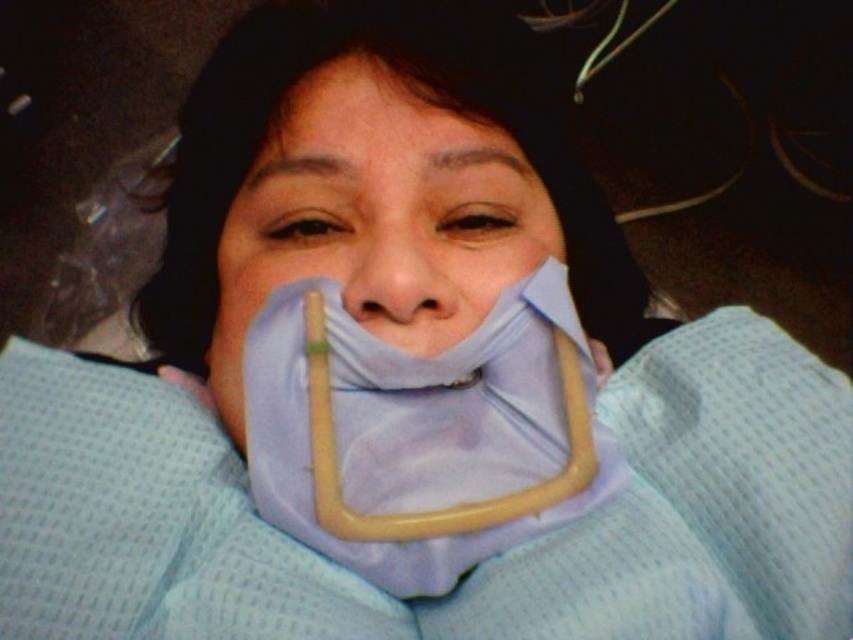
Question: Does light blue fabric at center have a larger size compared to blue fabric mask at center?

Choices:
 (A) no
 (B) yes

Answer: (A)

Question: Estimate the real-world distances between objects in this image. Which object is farther from the light blue fabric at center?

Choices:
 (A) blue fabric mask at center
 (B) matte blue fabric at center

Answer: (B)

Question: Is blue fabric mask at center wider than matte blue fabric at center?

Choices:
 (A) no
 (B) yes

Answer: (B)

Question: Is light blue fabric at center further to the viewer compared to blue fabric mask at center?

Choices:
 (A) yes
 (B) no

Answer: (B)

Question: Which object is the farthest from the matte blue fabric at center?

Choices:
 (A) light blue fabric at center
 (B) blue fabric mask at center

Answer: (A)

Question: Among these objects, which one is nearest to the camera?

Choices:
 (A) light blue fabric at center
 (B) matte blue fabric at center

Answer: (A)